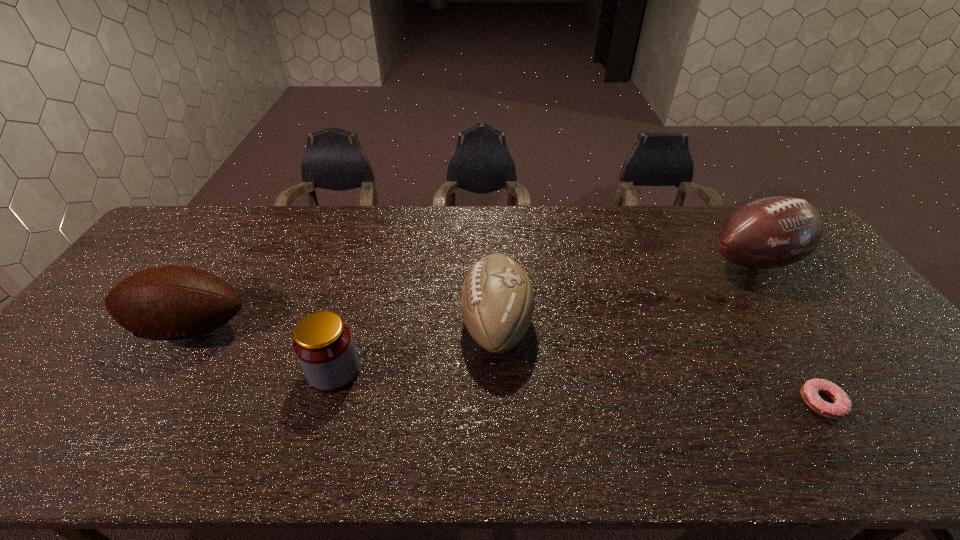
Find the location of a particular element. Image resolution: width=960 pixels, height=540 pixels. vacant space located 0.110m on the laces of the third object from left to right is located at coordinates (420, 325).

Find the location of a particular element. vacant point located 0.210m on the back of the fourth object from right to left is located at coordinates (357, 293).

Where is `blank space located 0.180m on the back of the doughnut`? The height and width of the screenshot is (540, 960). blank space located 0.180m on the back of the doughnut is located at coordinates (774, 328).

This screenshot has width=960, height=540. Identify the location of object at the far edge. (772, 232).

At what (x,y) coordinates should I click in order to perform the action: click on object that is at the left edge. Please return your answer as a coordinate pair (x, y). Image resolution: width=960 pixels, height=540 pixels. Looking at the image, I should click on (168, 302).

I want to click on object that is at the right edge, so click(772, 232).

Image resolution: width=960 pixels, height=540 pixels. Identify the location of object that is at the far right corner. (772, 232).

Locate an element on the screen. This screenshot has width=960, height=540. vacant space at the far edge is located at coordinates [x=459, y=233].

Identify the location of vacant region at the left edge. (108, 337).

Find the location of a particular element. vacant space at the right edge is located at coordinates tap(912, 391).